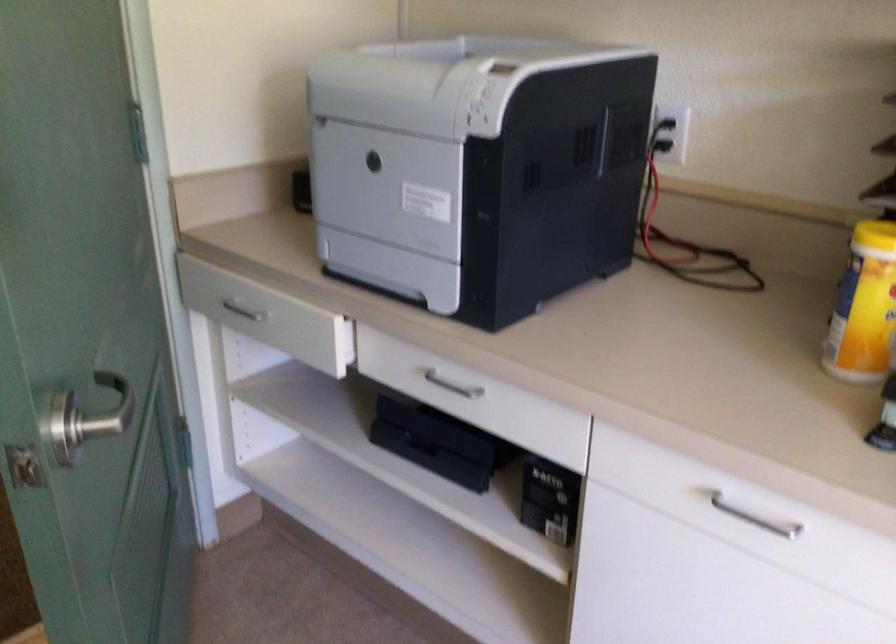
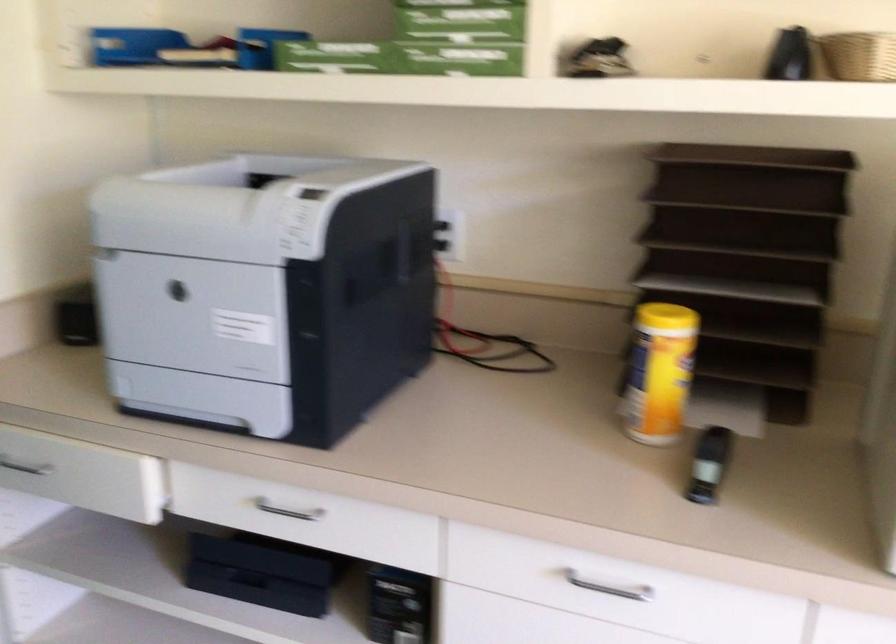
In the second image, find the point that corresponds to pixel 448 386 in the first image.

(287, 509)